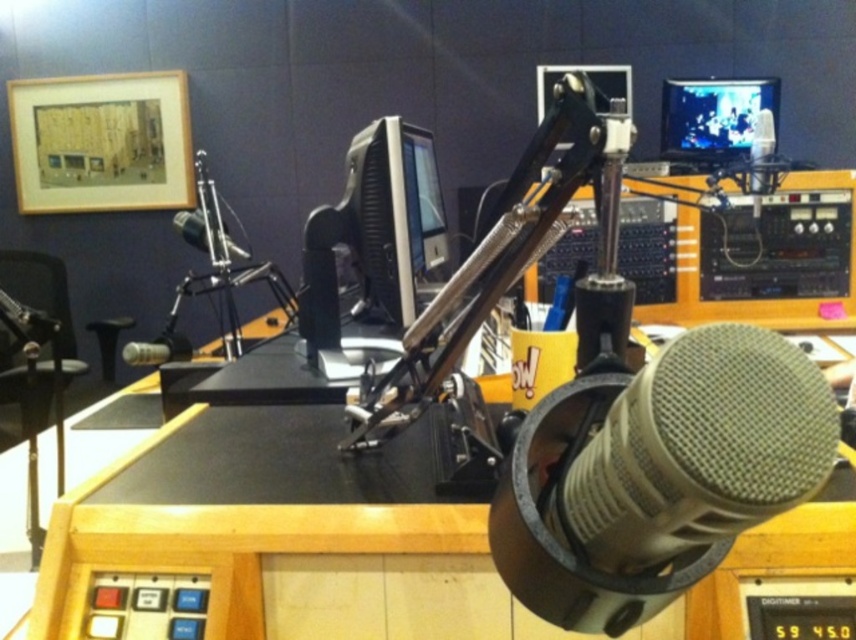
Does satin silver microphone at upper right have a lesser height compared to metallic silver microphone at center?

No.

Is satin silver microphone at upper right above metallic silver microphone at center?

Yes, satin silver microphone at upper right is above metallic silver microphone at center.

The width and height of the screenshot is (856, 640). I want to click on satin silver microphone at upper right, so click(761, 160).

Is satin silver microphone at upper right above satin black microphone at center?

Correct, satin silver microphone at upper right is located above satin black microphone at center.

Does point (767, 131) come closer to viewer compared to point (235, 252)?

No, it is behind (235, 252).

At what (x,y) coordinates should I click in order to perform the action: click on satin silver microphone at upper right. Please return your answer as a coordinate pair (x, y). This screenshot has width=856, height=640. Looking at the image, I should click on (761, 160).

Does matte gray microphone at center have a lesser height compared to matte black monitor at upper right?

Correct, matte gray microphone at center is not as tall as matte black monitor at upper right.

Describe the element at coordinates (657, 474) in the screenshot. I see `matte gray microphone at center` at that location.

Does point (533, 509) come closer to viewer compared to point (776, 90)?

Yes, it is.

Where is `matte gray microphone at center`? This screenshot has height=640, width=856. matte gray microphone at center is located at coordinates (657, 474).